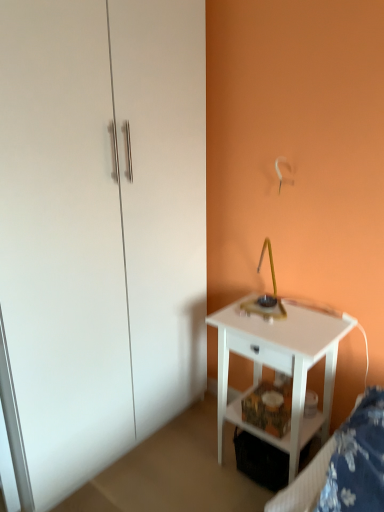
Identify the location of free point above white fabric bed frame at lower right (from a real-world perspective). The height and width of the screenshot is (512, 384). (359, 446).